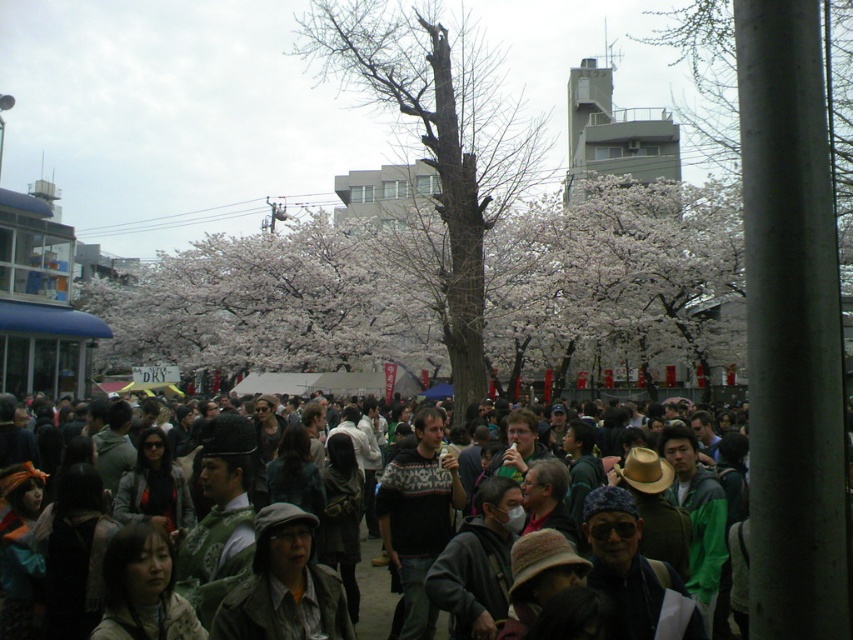
You are an artist wanting to sketch the scene. You notice the bare wood tree at center and the white blossoms at center. Which object should you draw with a narrower width in your sketch?

The bare wood tree at center has a lesser width compared to the white blossoms at center, so you should draw the bare wood tree at center with a narrower width.

You are standing in the middle of the crowd at the event. You see a bare wood tree at center and white blossoms at center. Which one is positioned to the left?

The bare wood tree at center is positioned to the left of the white blossoms at center.

You are standing in the crowd at the festival and see the bare wood tree at center and the dark gray jacket at center. Which object is positioned higher relative to the other?

The bare wood tree at center is located above the dark gray jacket at center, so it is positioned higher.